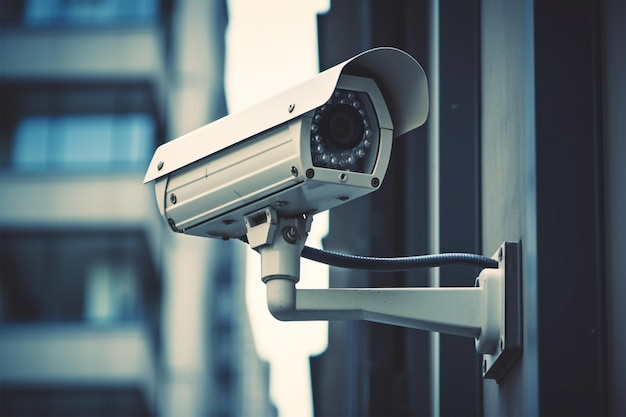
At what (x,y) coordinates should I click in order to perform the action: click on screws. Please return your answer as a coordinate pair (x, y). The image size is (626, 417). Looking at the image, I should click on (312, 172), (375, 180), (290, 109).